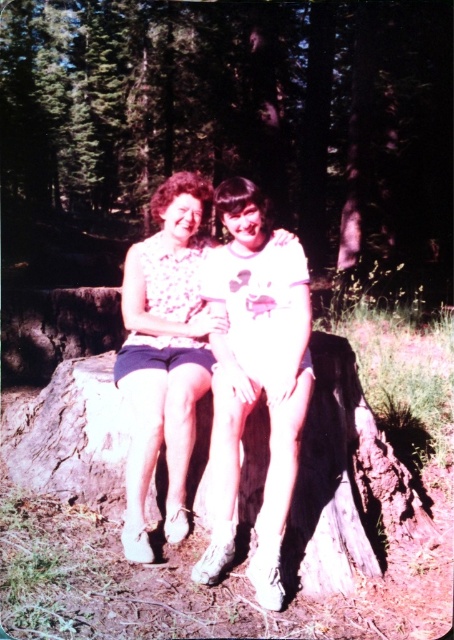
Can you confirm if floral fabric dress at center is positioned to the left of floral fabric blouse at center?

Incorrect, floral fabric dress at center is not on the left side of floral fabric blouse at center.

Who is more distant from viewer, (182, 195) or (195, 209)?

Positioned behind is point (195, 209).

At what (x,y) coordinates should I click in order to perform the action: click on floral fabric dress at center. Please return your answer as a coordinate pair (x, y). Looking at the image, I should click on (177, 410).

Between brown rough tree stump at center and floral fabric dress at center, which one is positioned lower?

floral fabric dress at center is below.

Is brown rough tree stump at center thinner than floral fabric dress at center?

In fact, brown rough tree stump at center might be wider than floral fabric dress at center.

This screenshot has width=454, height=640. I want to click on brown rough tree stump at center, so coord(241,116).

Identify the location of brown rough tree stump at center. The width and height of the screenshot is (454, 640). (241, 116).

Who is lower down, brown rough tree stump at center or floral fabric blouse at center?

floral fabric blouse at center

Between brown rough tree stump at center and floral fabric blouse at center, which one has less height?

With less height is floral fabric blouse at center.

This screenshot has height=640, width=454. I want to click on brown rough tree stump at center, so click(x=241, y=116).